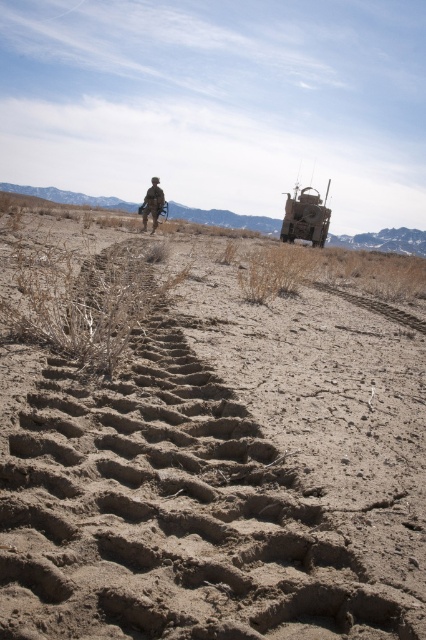
Question: Which of the following is the farthest from the observer?

Choices:
 (A) dull brown dirt at center
 (B) camouflage fabric military vehicle at upper center
 (C) camouflage uniform at center

Answer: (B)

Question: Which point is closer to the camera?

Choices:
 (A) camouflage fabric military vehicle at upper center
 (B) dull brown dirt at center

Answer: (B)

Question: Is camouflage fabric military vehicle at upper center to the right of camouflage uniform at center from the viewer's perspective?

Choices:
 (A) no
 (B) yes

Answer: (B)

Question: Which point appears farthest from the camera in this image?

Choices:
 (A) (307, 230)
 (B) (195, 592)
 (C) (150, 212)

Answer: (A)

Question: Can you confirm if dull brown dirt at center is positioned to the right of camouflage fabric military vehicle at upper center?

Choices:
 (A) yes
 (B) no

Answer: (B)

Question: Is dull brown dirt at center further to camera compared to camouflage fabric military vehicle at upper center?

Choices:
 (A) yes
 (B) no

Answer: (B)